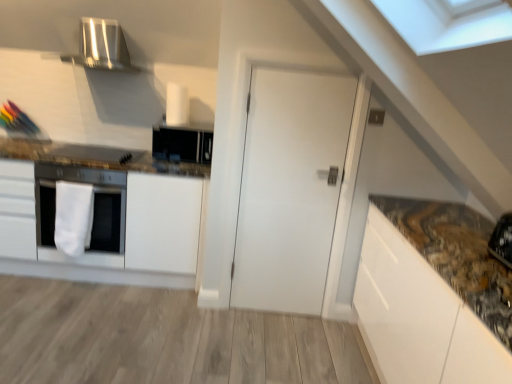
Locate an element on the screen. The width and height of the screenshot is (512, 384). free space in front of white matte door at center is located at coordinates (271, 336).